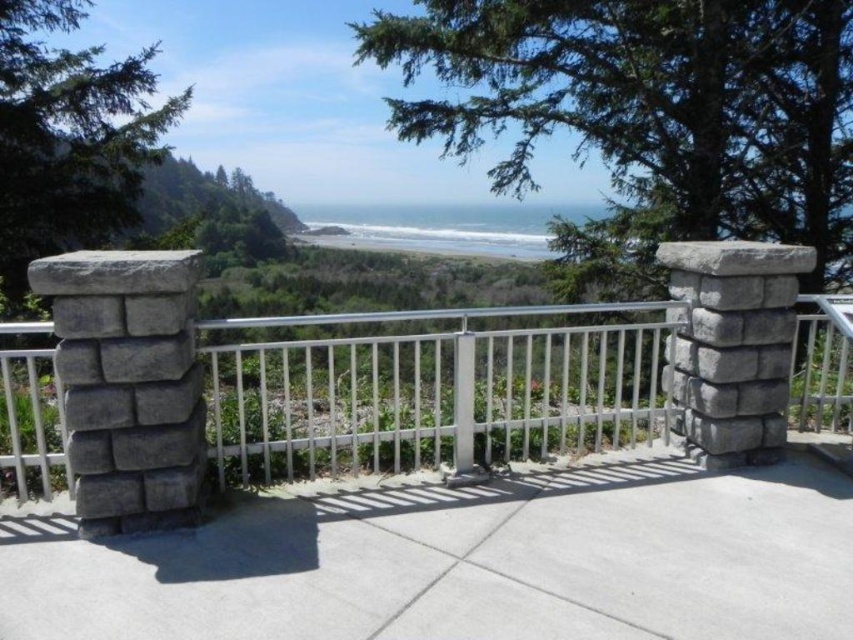
You are a delivery robot with a body length of 1.5 meters. You are positioned on the gray concrete deck at center and need to move forward to reach the white metal fence at center. Can you fully pass through the space between them without any part of your body exceeding the available distance?

The distance between the gray concrete deck at center and the white metal fence at center is 4.19 meters. Since your robot is 1.5 meters long, there is sufficient space for you to move forward and pass through without exceeding the available distance.

You are standing on the gray concrete deck at center and want to walk to the white metal fence at center. Which direction should you move to reach it?

The gray concrete deck at center is positioned on the right side of the white metal fence at center, so you should move to your left to reach it.